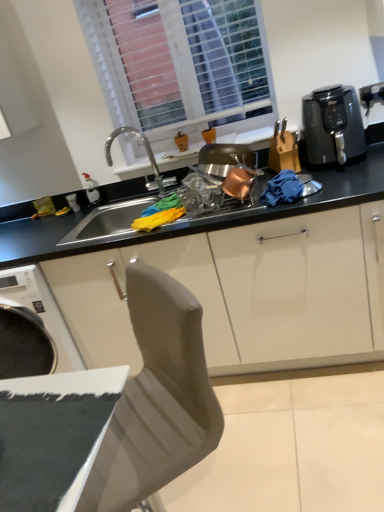
The image size is (384, 512). I want to click on vacant space underneath white plastic window at upper center (from a real-world perspective), so click(213, 138).